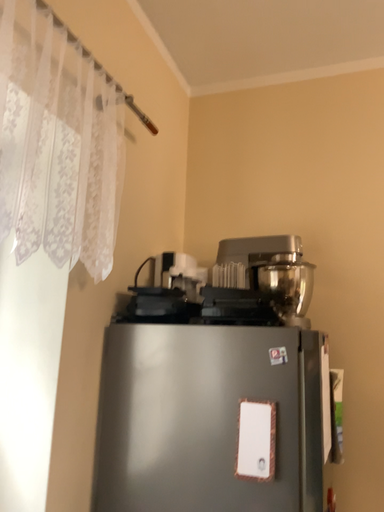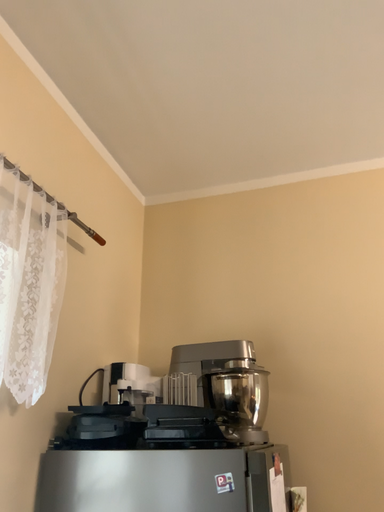
Question: How did the camera likely rotate when shooting the video?

Choices:
 (A) rotated upward
 (B) rotated downward

Answer: (A)